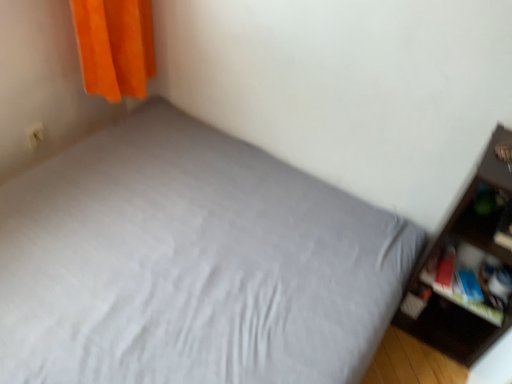
Question: In terms of size, does gray fabric bed at center appear bigger or smaller than matte plastic cabinet at right?

Choices:
 (A) small
 (B) big

Answer: (B)

Question: Based on their positions, is gray fabric bed at center located to the left or right of matte plastic cabinet at right?

Choices:
 (A) left
 (B) right

Answer: (A)

Question: Based on their relative distances, which object is farther from the gray fabric bed at center?

Choices:
 (A) matte plastic cabinet at right
 (B) matte dark brown shelf at right

Answer: (B)

Question: Which is farther from the gray fabric bed at center?

Choices:
 (A) matte plastic cabinet at right
 (B) matte dark brown shelf at right

Answer: (B)